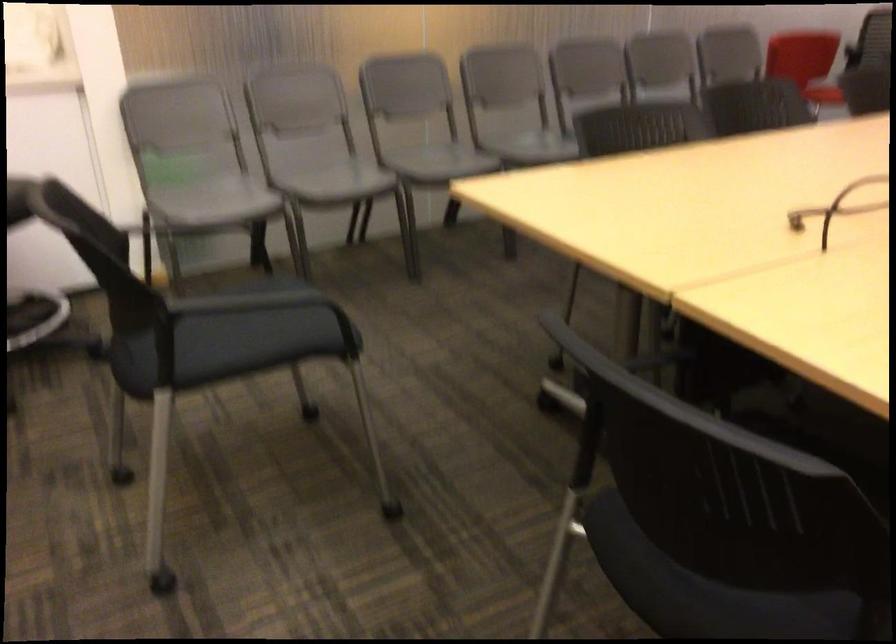
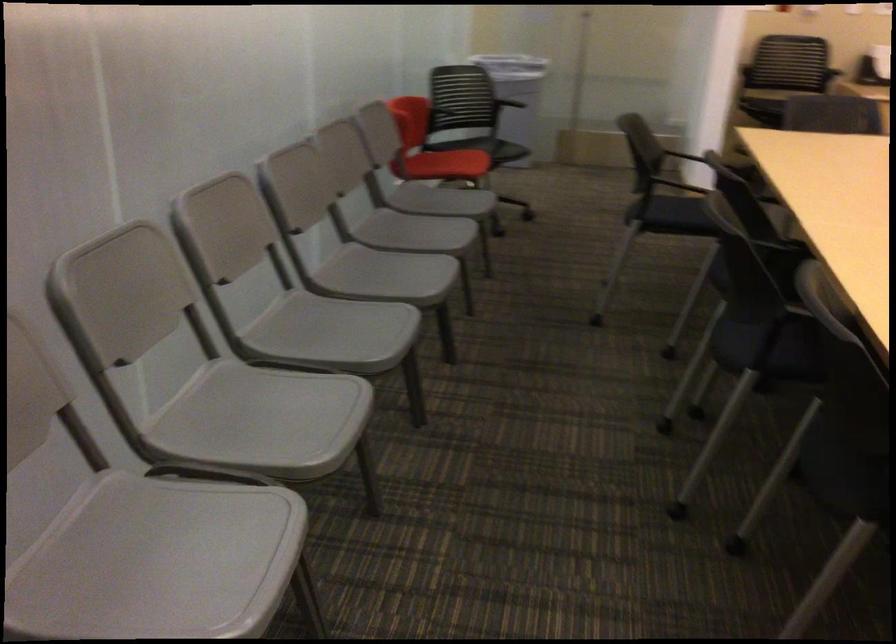
Where in the second image is the point corresponding to (446,156) from the first image?

(263, 420)